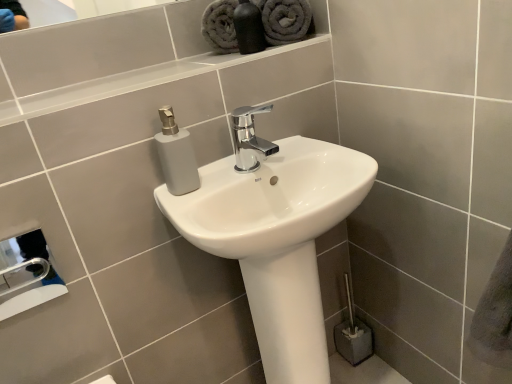
Find the location of a particular element. The image size is (512, 384). vacant region to the left of chrome metallic faucet at center is located at coordinates (212, 177).